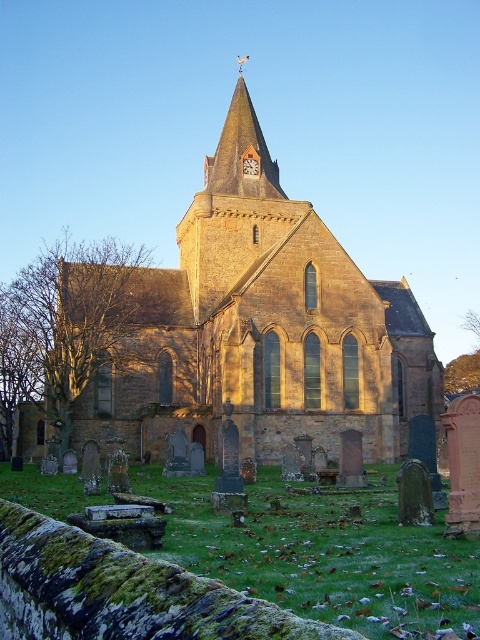
Does point (257, 124) come in front of point (253, 164)?

No.

Identify the location of brown stone church at center. This screenshot has height=640, width=480. (262, 326).

Does point (241, 237) come farther from viewer compared to point (220, 189)?

No, (241, 237) is closer to viewer.

Can you confirm if brown stone church at center is positioned to the left of brown stone spire at upper center?

Yes, brown stone church at center is to the left of brown stone spire at upper center.

Locate an element on the screen. brown stone church at center is located at coordinates (262, 326).

Locate an element on the screen. brown stone church at center is located at coordinates (262, 326).

In the scene shown: Is the position of brown stone spire at upper center more distant than that of matte brown clock at center?

No, it is not.

Is brown stone spire at upper center bigger than matte brown clock at center?

Correct, brown stone spire at upper center is larger in size than matte brown clock at center.

Which is behind, point (243, 100) or point (245, 173)?

The point (243, 100) is more distant.

You are a GUI agent. You are given a task and a screenshot of the screen. Output one action in this format:
    pyautogui.click(x=<x>, y=<y>)
    Task: Click on the brown stone spire at upper center
    Image resolution: width=480 pixels, height=640 pixels.
    Given the screenshot: What is the action you would take?
    pyautogui.click(x=240, y=152)